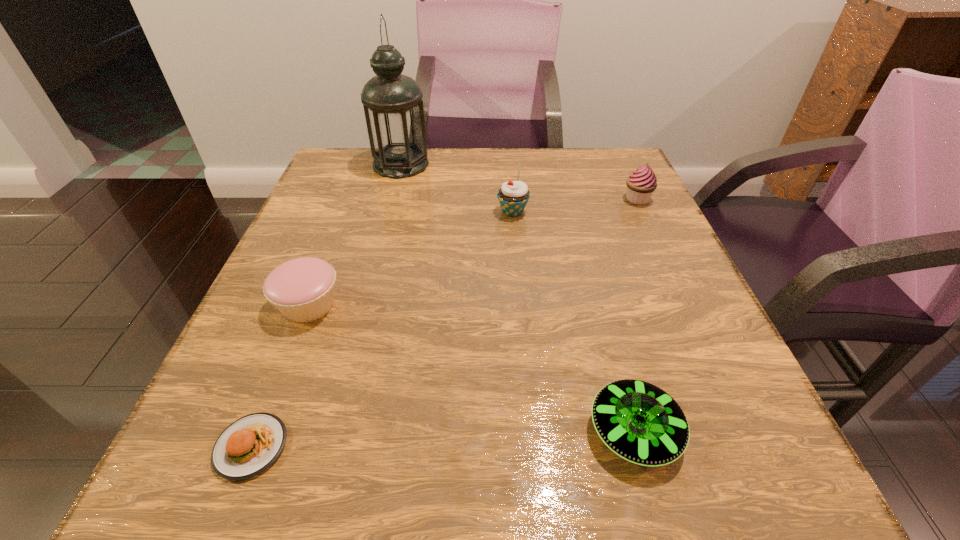
The height and width of the screenshot is (540, 960). Identify the location of free space at the left edge of the desktop. (328, 252).

In the image, there is a desktop. Identify the location of vacant space at the right edge. (756, 426).

In the image, there is a desktop. In order to click on free space at the far left corner in this screenshot , I will do `click(351, 170)`.

The height and width of the screenshot is (540, 960). In the image, there is a desktop. Find the location of `vacant area at the far right corner`. vacant area at the far right corner is located at coordinates (605, 148).

The image size is (960, 540). Find the location of `free space at the near right corner`. free space at the near right corner is located at coordinates pos(740,447).

You are a GUI agent. You are given a task and a screenshot of the screen. Output one action in this format:
    pyautogui.click(x=<x>, y=<y>)
    Task: Click on the vacant space that's between the leftmost cupcake and the food
    Image resolution: width=960 pixels, height=540 pixels.
    Given the screenshot: What is the action you would take?
    pyautogui.click(x=280, y=376)

I want to click on vacant area between the shortest cupcake and the rightmost object, so [x=473, y=252].

Locate an element on the screen. Image resolution: width=960 pixels, height=540 pixels. vacant space that is in between the fourth object from left to right and the farthest object is located at coordinates (457, 188).

The image size is (960, 540). I want to click on free spot between the fourth object from left to right and the fifth tallest object, so click(573, 322).

You are a GUI agent. You are given a task and a screenshot of the screen. Output one action in this format:
    pyautogui.click(x=<x>, y=<y>)
    Task: Click on the vacant area that lies between the rightmost object and the second shortest object
    The height and width of the screenshot is (540, 960).
    Given the screenshot: What is the action you would take?
    pyautogui.click(x=636, y=315)